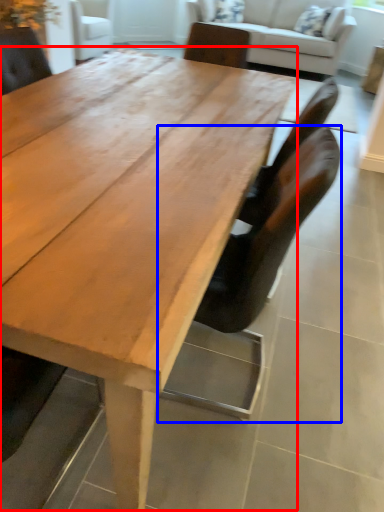
Question: Which object is closer to the camera taking this photo, coffee table (highlighted by a red box) or chair (highlighted by a blue box)?

Choices:
 (A) coffee table
 (B) chair

Answer: (A)